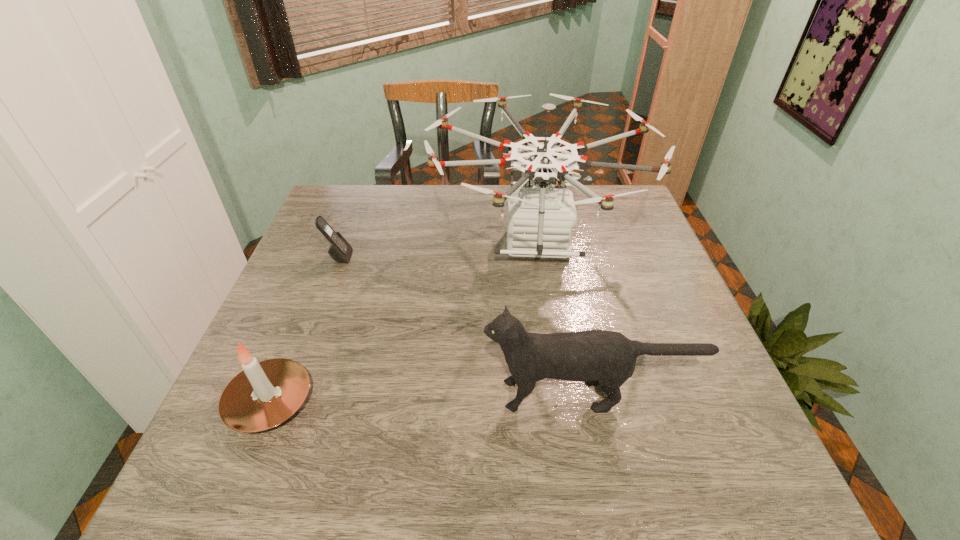
Where is `vacant space that is in between the shortest object and the second tallest object`? vacant space that is in between the shortest object and the second tallest object is located at coordinates (464, 326).

Identify the location of free space that is in between the shortest object and the tallest object. (437, 251).

I want to click on free space between the tallest object and the third shortest object, so click(562, 319).

I want to click on object that can be found as the second closest to the candle, so click(x=340, y=250).

Find the location of a particular element. object that is the second nearest to the shortest object is located at coordinates (265, 394).

You are a GUI agent. You are given a task and a screenshot of the screen. Output one action in this format:
    pyautogui.click(x=<x>, y=<y>)
    Task: Click on the vacant region that satisfies the following two spatial constraints: 1. on the front-facing side of the cellular telephone; 2. on the front side of the second shortest object
    The height and width of the screenshot is (540, 960).
    Given the screenshot: What is the action you would take?
    pyautogui.click(x=285, y=402)